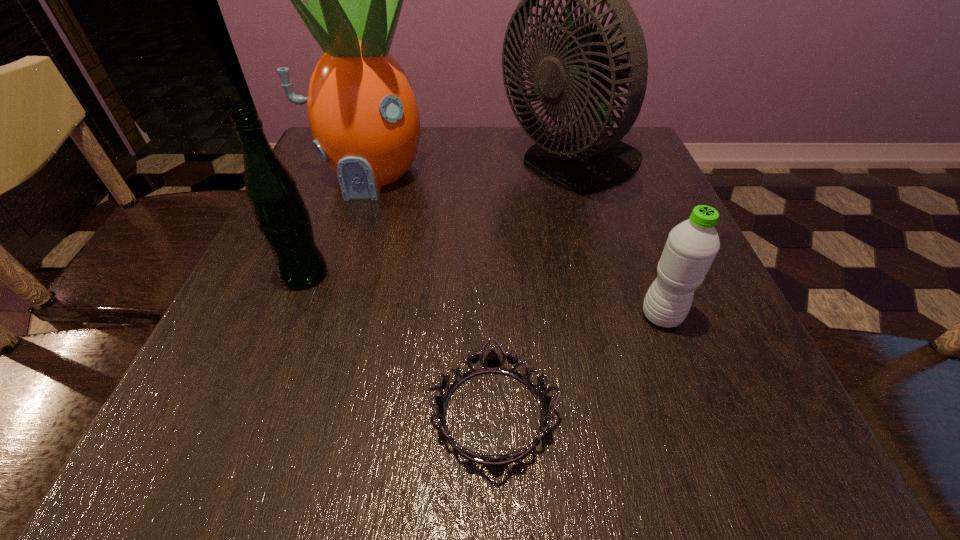
Identify the location of vacant position located 0.200m in front of the fan to direct airflow. (414, 167).

You are a GUI agent. You are given a task and a screenshot of the screen. Output one action in this format:
    pyautogui.click(x=<x>, y=<y>)
    Task: Click on the free location located in front of the fan to direct airflow
    The width and height of the screenshot is (960, 540).
    Given the screenshot: What is the action you would take?
    pyautogui.click(x=422, y=167)

Where is `free location located on the back of the third shortest object`? This screenshot has height=540, width=960. free location located on the back of the third shortest object is located at coordinates (322, 231).

The image size is (960, 540). In order to click on vacant position located on the left of the water bottle in this screenshot , I will do `click(597, 316)`.

Find the location of a particular element. The width and height of the screenshot is (960, 540). blank area located on the front-facing side of the tiara is located at coordinates (354, 414).

At what (x,y) coordinates should I click in order to perform the action: click on vacant area situated on the front-facing side of the tiara. Please return your answer as a coordinate pair (x, y). This screenshot has height=540, width=960. Looking at the image, I should click on (233, 414).

Find the location of a particular element. vacant space situated on the front-facing side of the tiara is located at coordinates (180, 414).

The height and width of the screenshot is (540, 960). I want to click on pineapple that is at the far edge, so click(x=362, y=110).

Image resolution: width=960 pixels, height=540 pixels. Identify the location of fan situated at the far edge. (585, 71).

Image resolution: width=960 pixels, height=540 pixels. I want to click on object that is at the near edge, so click(492, 363).